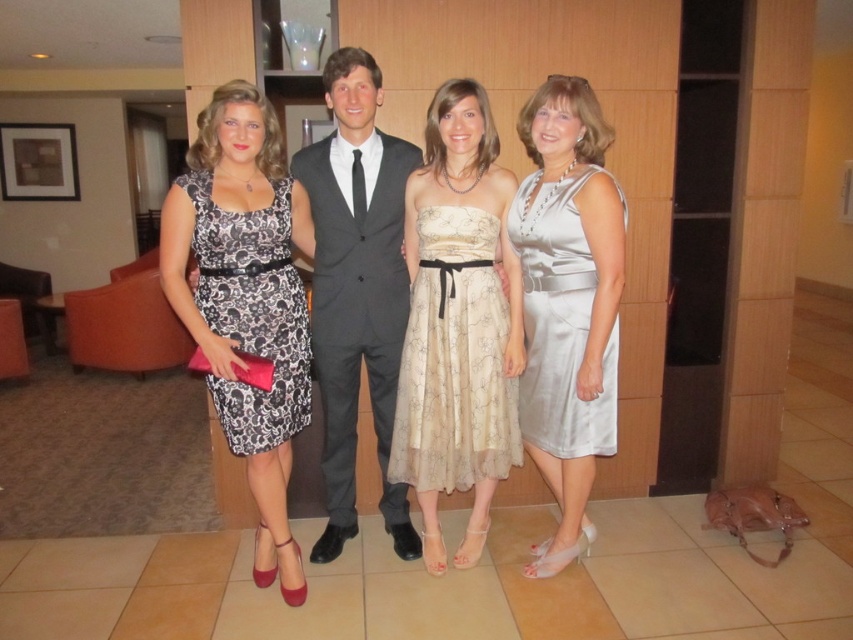
You are a photographer at the event and want to ensure all guests are visible in the group photo. The printed fabric dress at center and the satin silver dress at right are in the frame. Which of these two dresses should be moved forward to avoid being blocked by the taller individual?

The printed fabric dress at center is much taller than the satin silver dress at right, so moving the satin silver dress at right forward would prevent it from being blocked by the taller individual in the printed fabric dress at center.

From the picture: You are a photographer setting up for a group photo. You need to position two subjects, the printed fabric dress at center and the matte gray suit at center, so that there is exactly 10 inches between them. Based on their current positions, do you need to move them closer together or farther apart?

The printed fabric dress at center is currently 9.51 inches away from the matte gray suit at center. Since 9.51 inches is less than the required 10 inches, you need to move them slightly farther apart to achieve the desired distance.

You are standing in the lounge area and need to locate the printed fabric dress at center. Based on the coordinates provided, which direction should you look to find it?

The printed fabric dress at center is located at coordinates point (x=247, y=300), which means you should look towards the center of the room to find it.